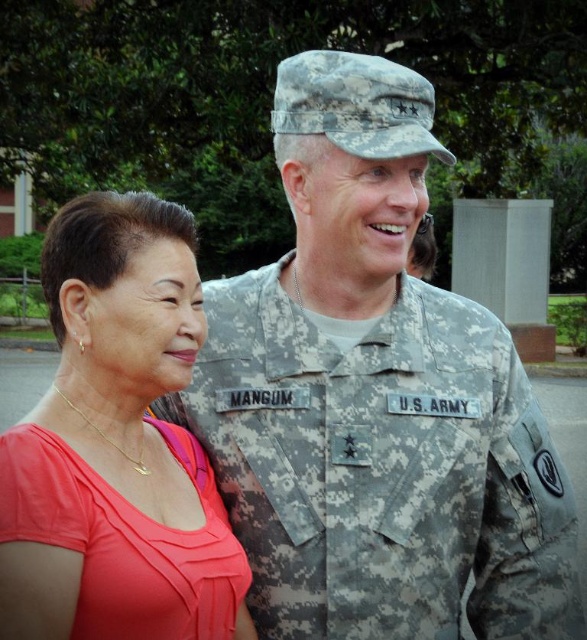
You are a photographer trying to capture a closeup of the camouflage uniform at center. Given that the camera is focused on the point at coordinates point [375,397], will this point be the center of the image?

The point [375,397] corresponds to the camouflage uniform at center, so yes, the camera is focused on the camouflage uniform at center, making that point the center of the image.

You are a photographer trying to capture a portrait of both the older woman and the person in the camouflage uniform at center and the camouflage fabric uniform at center. Which of the two camouflage uniforms is positioned higher in the image?

The camouflage uniform at center is positioned higher than the camouflage fabric uniform at center in the image.